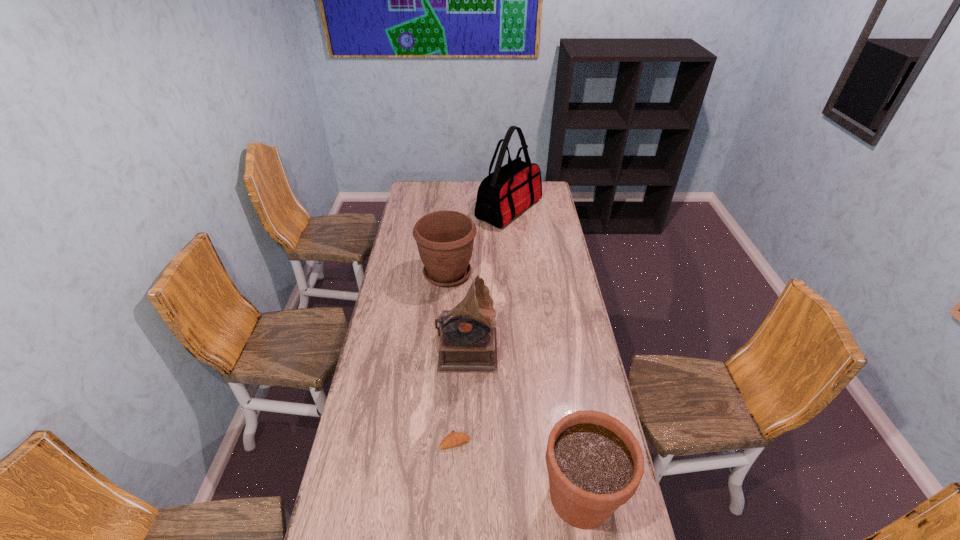
You are a GUI agent. You are given a task and a screenshot of the screen. Output one action in this format:
    pyautogui.click(x=<x>, y=<y>)
    Task: Click on the free spot located on the back of the farther flowerpot
    The image size is (960, 540).
    Given the screenshot: What is the action you would take?
    pyautogui.click(x=451, y=231)

At what (x,y) coordinates should I click in order to perform the action: click on vacant space located on the back of the shortest object. Please return your answer as a coordinate pair (x, y). Image resolution: width=960 pixels, height=540 pixels. Looking at the image, I should click on (458, 387).

Locate an element on the screen. This screenshot has height=540, width=960. object present at the far edge is located at coordinates (508, 191).

The image size is (960, 540). I want to click on object at the left edge, so click(445, 239).

Locate an element on the screen. object that is at the right edge is located at coordinates (508, 191).

This screenshot has height=540, width=960. I want to click on object located in the far right corner section of the desktop, so click(508, 191).

Locate an element on the screen. free space at the far edge of the desktop is located at coordinates (466, 183).

Identify the location of vacant space at the left edge of the desktop. This screenshot has width=960, height=540. (401, 226).

Locate an element on the screen. free point at the right edge is located at coordinates (536, 224).

In the image, there is a desktop. Where is `free region at the far left corner`? Image resolution: width=960 pixels, height=540 pixels. free region at the far left corner is located at coordinates (414, 187).